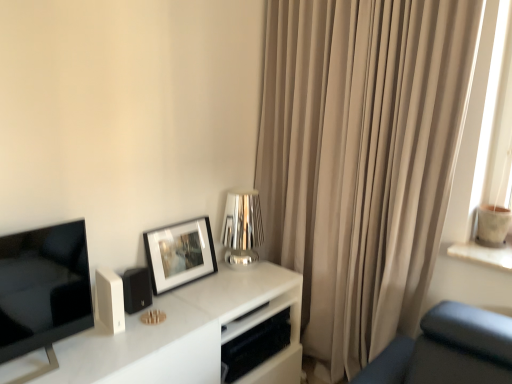
Identify the location of free area in between white plastic speaker at lower left and black glossy television at left. (84, 340).